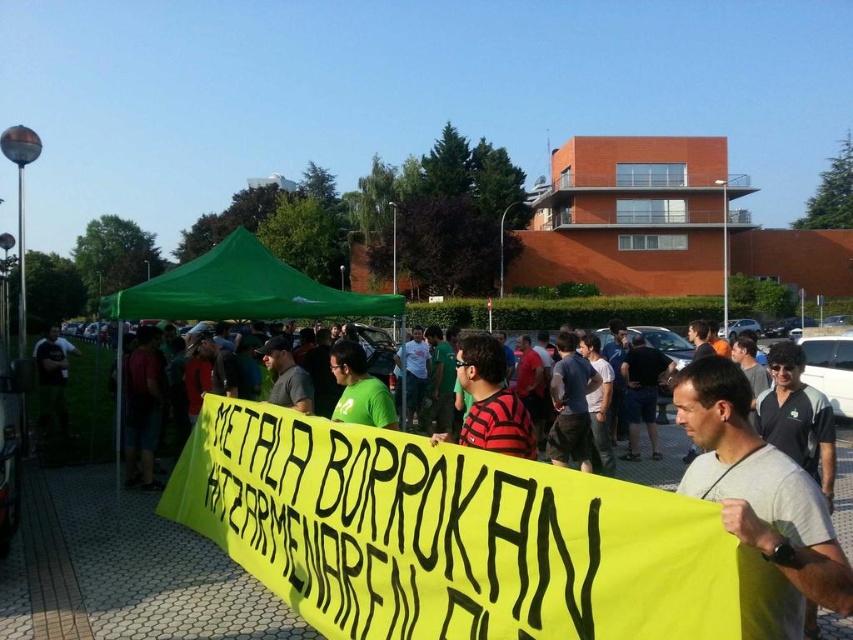
Based on the photo, is green fabric canopy at center positioned at the back of striped cotton shirt at center?

Yes, it is.

Which is in front, point (311, 316) or point (467, 419)?

Point (467, 419) is more forward.

Find the location of a particular element. green fabric canopy at center is located at coordinates (241, 289).

Consider the image. Is gray fabric at center smaller than green fabric canopy at center?

Yes, gray fabric at center is smaller than green fabric canopy at center.

Is point (786, 588) farther from camera compared to point (383, 292)?

No, it is not.

You are a GUI agent. You are given a task and a screenshot of the screen. Output one action in this format:
    pyautogui.click(x=<x>, y=<y>)
    Task: Click on the gray fabric at center
    This screenshot has height=640, width=853.
    Given the screenshot: What is the action you would take?
    pyautogui.click(x=759, y=490)

Does point (817, 532) lie in front of point (502, 381)?

Yes.

Is gray fabric at center smaller than striped cotton shirt at center?

Indeed, gray fabric at center has a smaller size compared to striped cotton shirt at center.

I want to click on gray fabric at center, so click(x=759, y=490).

Identify the location of gray fabric at center. The image size is (853, 640). (759, 490).